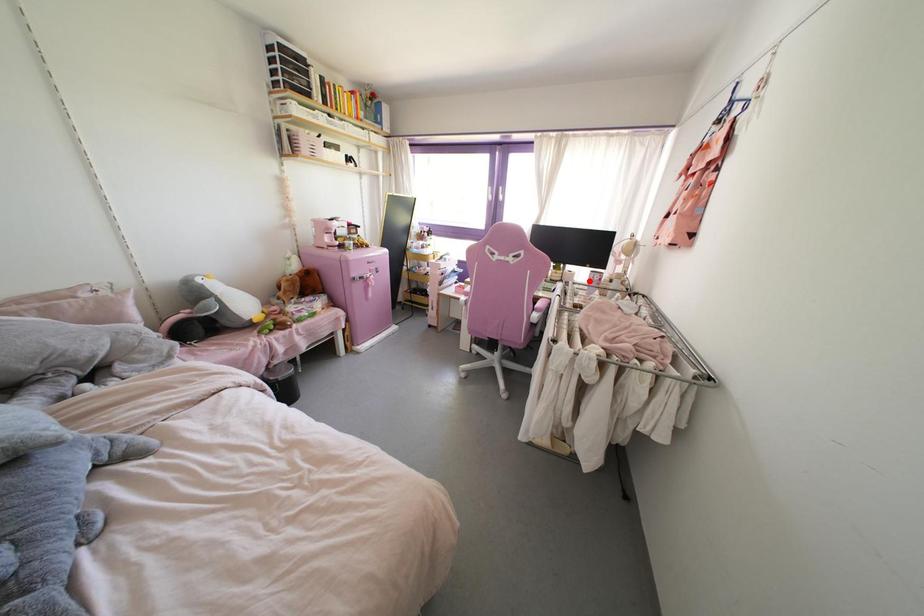
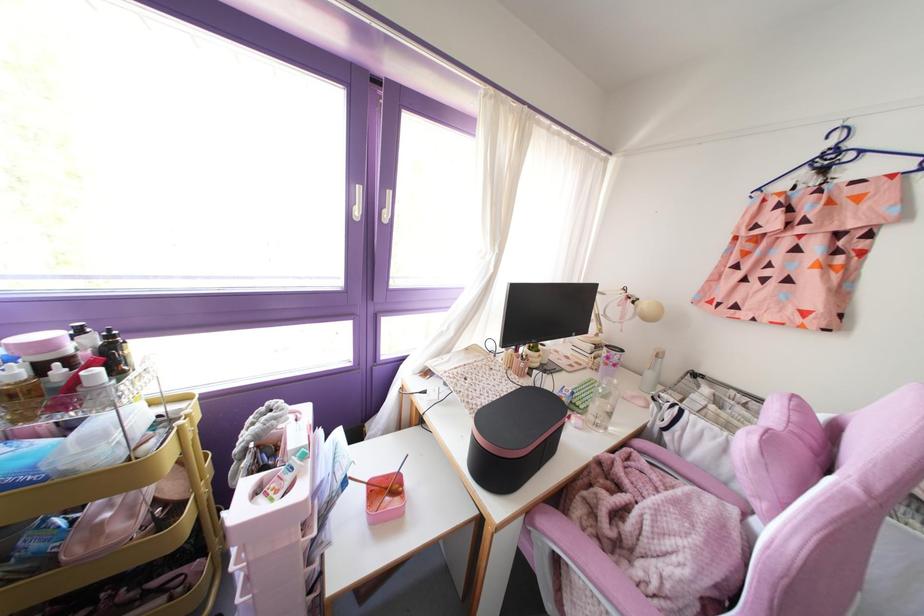
Question: I am providing you with two images of the same scene from different viewpoints. In image1, a red point is highlighted. Considering the same 3D point in image2, which of the following is correct?

Choices:
 (A) It is closer
 (B) It is farther

Answer: (A)